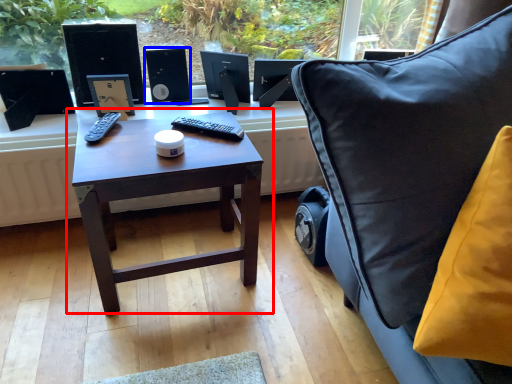
Question: Which object appears closest to the camera in this image, table (highlighted by a red box) or speaker (highlighted by a blue box)?

Choices:
 (A) table
 (B) speaker

Answer: (A)